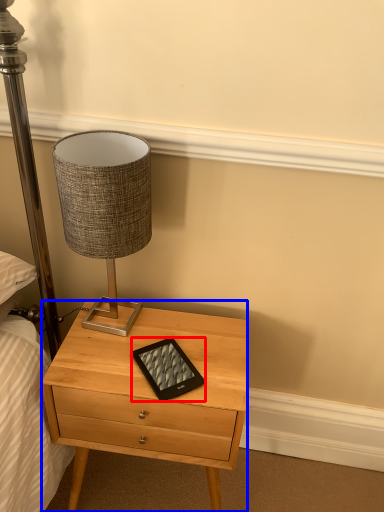
Question: Which object appears closest to the camera in this image, tablet computer (highlighted by a red box) or nightstand (highlighted by a blue box)?

Choices:
 (A) tablet computer
 (B) nightstand

Answer: (B)